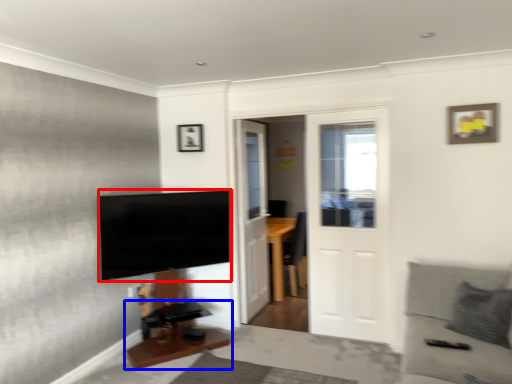
Question: Which object appears farthest to the camera in this image, television (highlighted by a red box) or table (highlighted by a blue box)?

Choices:
 (A) television
 (B) table

Answer: (A)